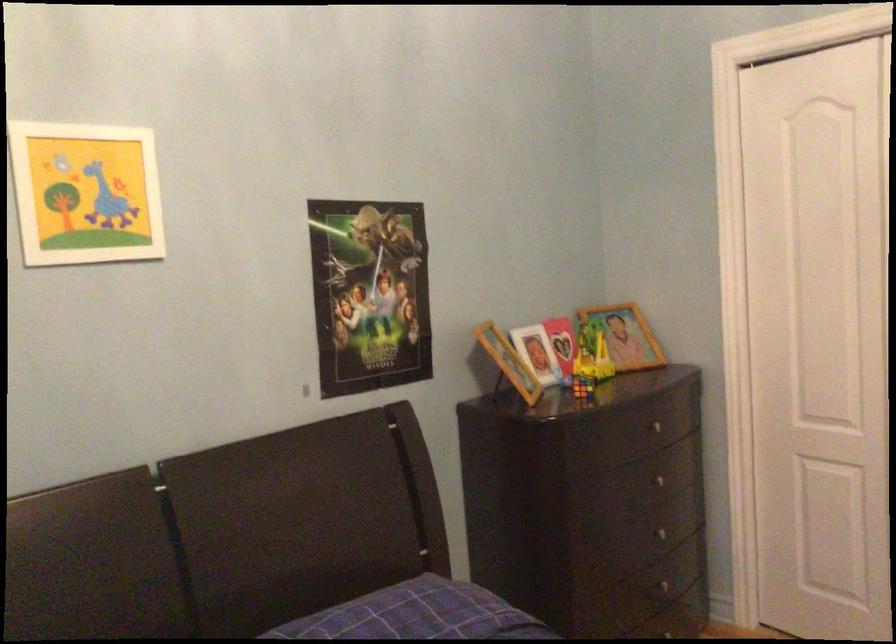
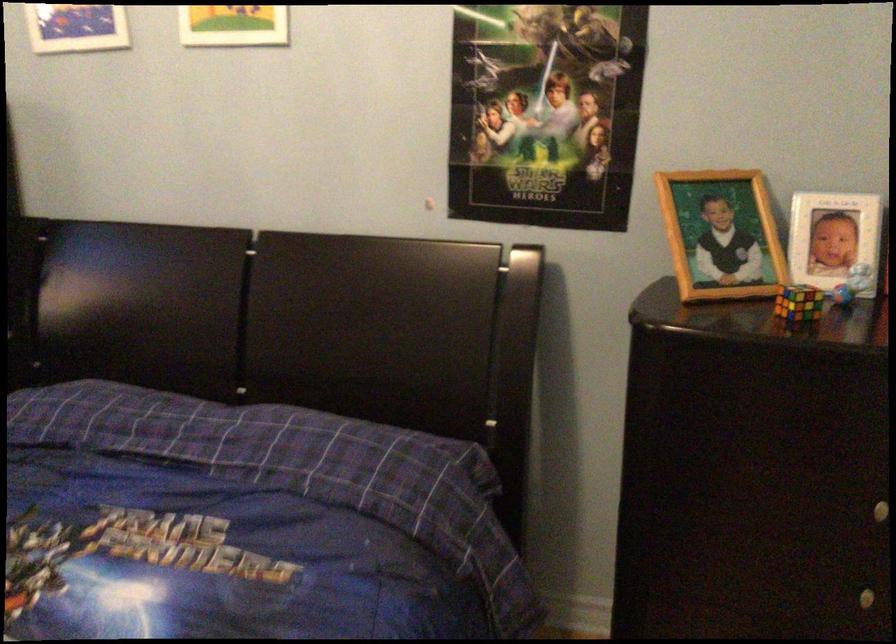
In the second image, find the point that corresponds to (590,383) in the first image.

(798, 303)